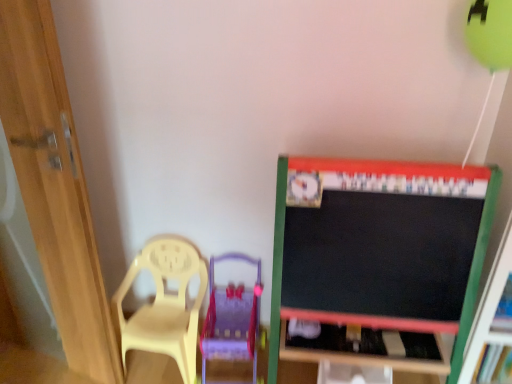
Question: Is the depth of yellow plastic chair at left less than that of wooden table at lower center?

Choices:
 (A) yes
 (B) no

Answer: (A)

Question: Are yellow plastic chair at left and wooden table at lower center located far from each other?

Choices:
 (A) no
 (B) yes

Answer: (A)

Question: Considering the relative sizes of yellow plastic chair at left and wooden table at lower center in the image provided, is yellow plastic chair at left shorter than wooden table at lower center?

Choices:
 (A) no
 (B) yes

Answer: (A)

Question: Is yellow plastic chair at left smaller than wooden table at lower center?

Choices:
 (A) yes
 (B) no

Answer: (B)

Question: From the image's perspective, does yellow plastic chair at left appear higher than wooden table at lower center?

Choices:
 (A) no
 (B) yes

Answer: (B)

Question: Is wooden door at left in front of or behind translucent yellow swivel chair at lower left in the image?

Choices:
 (A) behind
 (B) front

Answer: (B)

Question: From the image's perspective, is wooden door at left positioned above or below translucent yellow swivel chair at lower left?

Choices:
 (A) above
 (B) below

Answer: (A)

Question: Looking at their shapes, would you say wooden door at left is wider or thinner than translucent yellow swivel chair at lower left?

Choices:
 (A) wide
 (B) thin

Answer: (B)

Question: Would you say wooden door at left is to the left or to the right of translucent yellow swivel chair at lower left in the picture?

Choices:
 (A) left
 (B) right

Answer: (A)

Question: Is translucent yellow swivel chair at lower left in front of or behind wooden table at lower center in the image?

Choices:
 (A) behind
 (B) front

Answer: (B)

Question: Is point (252, 380) positioned closer to the camera than point (290, 359)?

Choices:
 (A) farther
 (B) closer

Answer: (A)

Question: Is translucent yellow swivel chair at lower left spatially inside wooden table at lower center, or outside of it?

Choices:
 (A) inside
 (B) outside

Answer: (B)

Question: Looking at their shapes, would you say translucent yellow swivel chair at lower left is wider or thinner than wooden table at lower center?

Choices:
 (A) thin
 (B) wide

Answer: (B)

Question: Considering the positions of wooden table at lower center and wooden door at left in the image, is wooden table at lower center taller or shorter than wooden door at left?

Choices:
 (A) short
 (B) tall

Answer: (A)

Question: Relative to wooden door at left, is wooden table at lower center in front or behind?

Choices:
 (A) behind
 (B) front

Answer: (A)